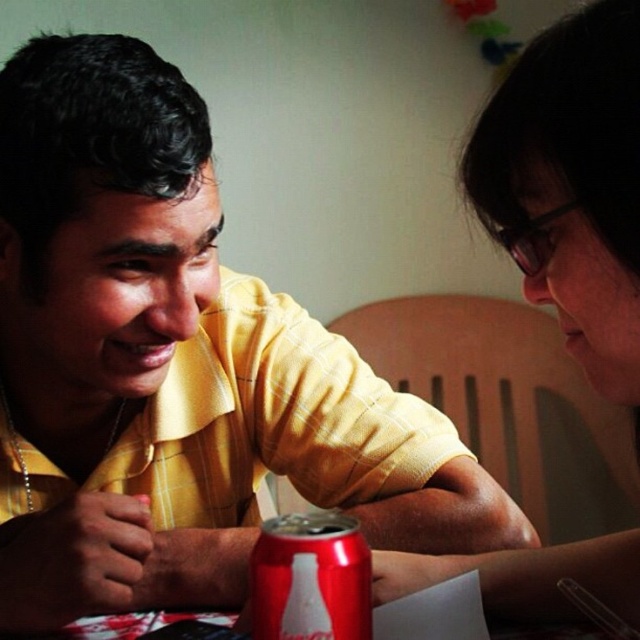
You are a waiter in a cafe and see the matte black glasses at upper right and the red matte can at center on the table. Which object should you avoid knocking over if you want to prioritize the larger one?

The matte black glasses at upper right is larger than the red matte can at center, so you should avoid knocking over the matte black glasses at upper right.

You are a waiter at a cafe and need to deliver a dessert to the customer seated at the table. The dessert needs to be placed on the table without moving the matte black glasses at upper right or the red matte can at center. Where should you place the dessert?

The dessert should be placed behind the red matte can at center, as the matte black glasses at upper right is in front of it, leaving space behind the can for the dessert.

You are a delivery robot with a 6 inch wide package. You need to place it on the table between the matte black glasses at upper right and the red matte can at center. Is there enough space?

The distance between the matte black glasses at upper right and the red matte can at center is 7.48 inches. Since the package is 6 inches wide, there is enough space to place it between them.